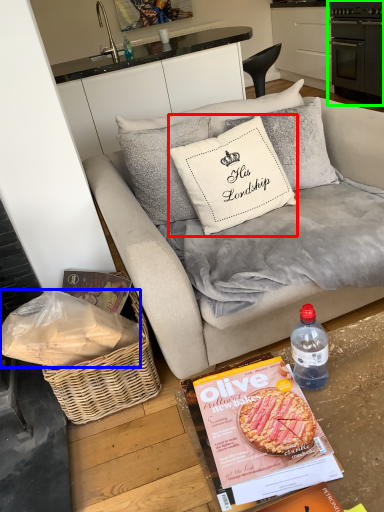
Question: Which is nearer to the pillow (highlighted by a red box)? material (highlighted by a blue box) or appliance (highlighted by a green box).

Choices:
 (A) material
 (B) appliance

Answer: (A)